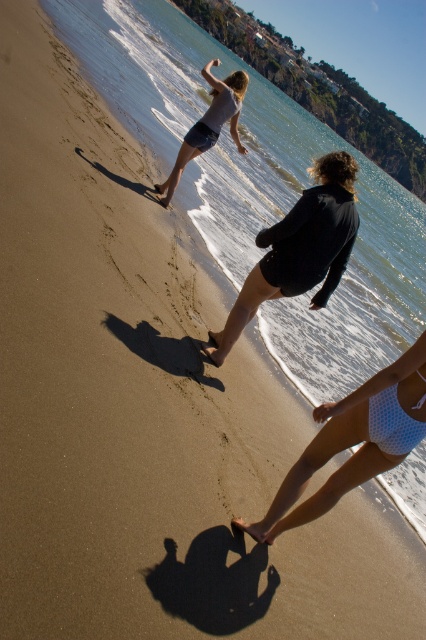
You are a photographer trying to capture a shot of the two people in the scene. The white polka dot swimsuit at lower center and the matte gray shorts at upper center are both in your frame. Based on their positions, which one is closer to the camera?

The white polka dot swimsuit at lower center is closer to the camera because it is shorter than the matte gray shorts at upper center, indicating it is positioned in front.

You are a photographer trying to capture a candid shot of the white mesh bikini top at lower right without including the matte gray shorts at upper center in the frame. Is this possible given their positions?

The white mesh bikini top at lower right is behind the matte gray shorts at upper center, so it would be blocked from view. Therefore, capturing the white mesh bikini top at lower right without the matte gray shorts at upper center in the frame is not possible.